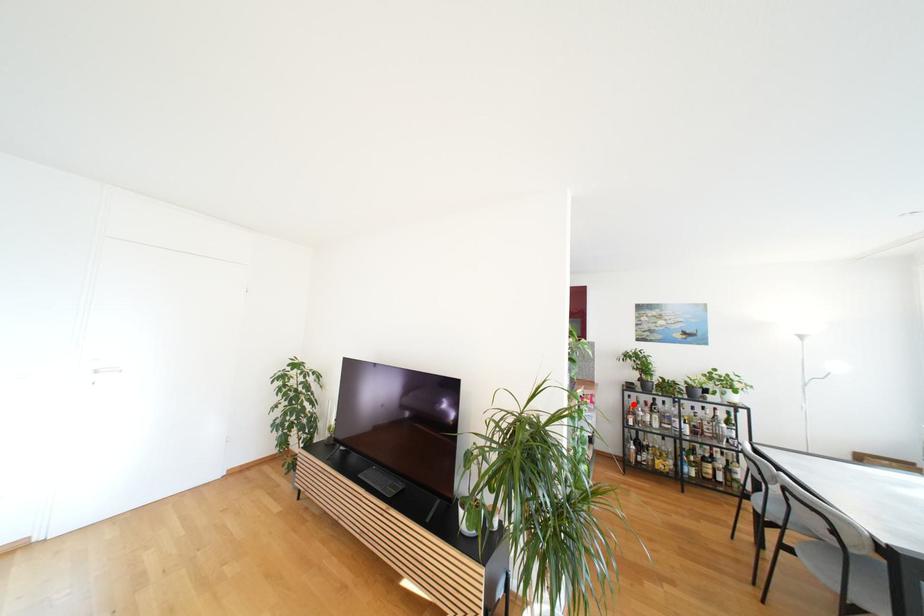
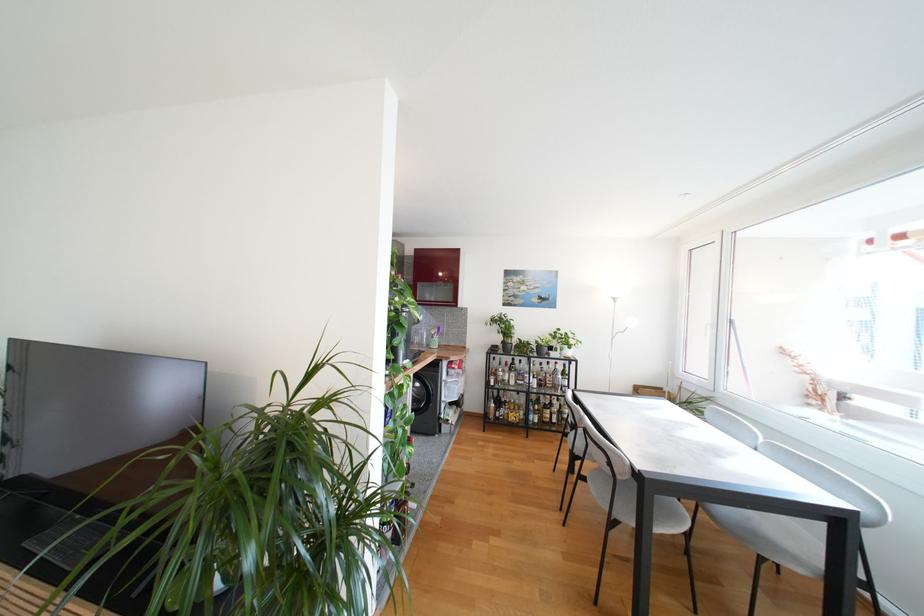
Question: I am providing you with two images of the same scene from different viewpoints. A red point is marked on the first image. Can you still see the location of the red point in image 2?

Choices:
 (A) Yes
 (B) No

Answer: (A)